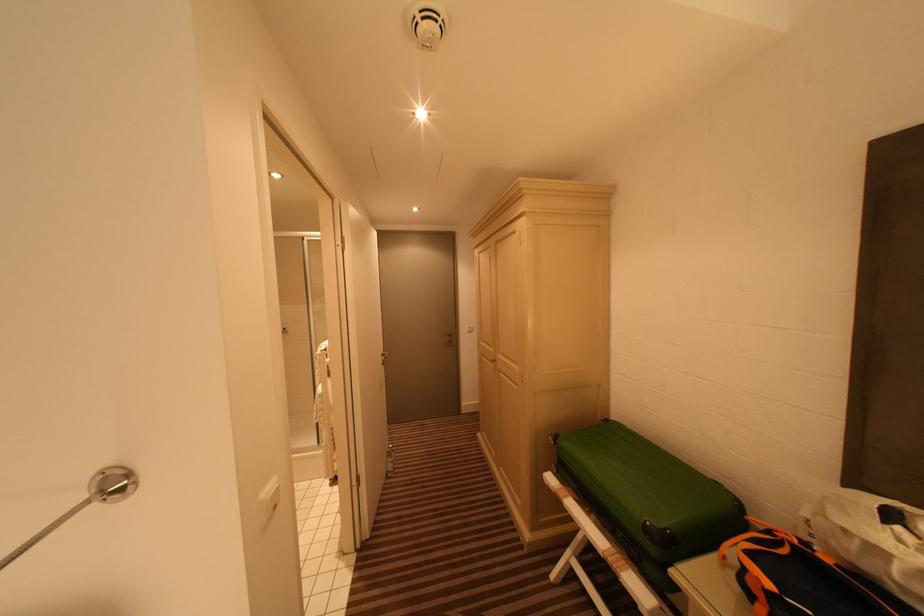
Which object does [801,578] point to?

It corresponds to the orange and black bag in the image.